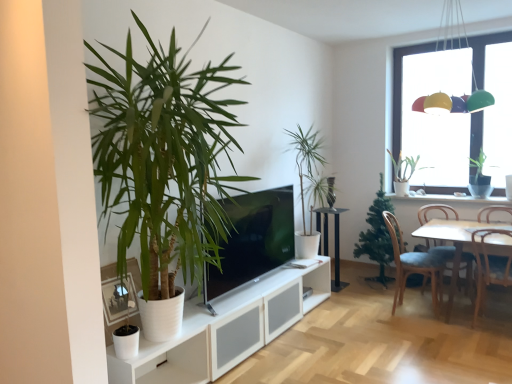
You are a GUI agent. You are given a task and a screenshot of the screen. Output one action in this format:
    pyautogui.click(x=<x>, y=<y>)
    Task: Click on the vacant area in front of green matte christmas tree at center, arranged as the 4th houseplant when viewed from the front
    
    Given the screenshot: What is the action you would take?
    pyautogui.click(x=382, y=297)